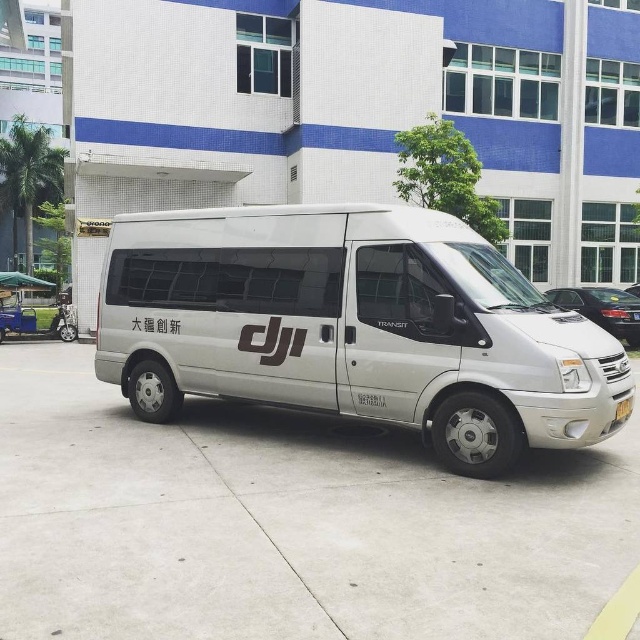
Question: Among these objects, which one is farthest from the camera?

Choices:
 (A) white concrete pavement at center
 (B) white metallic van at center

Answer: (B)

Question: Does white concrete pavement at center lie in front of white metallic van at center?

Choices:
 (A) no
 (B) yes

Answer: (B)

Question: Is white metallic van at center below yellow rubber curb at lower right?

Choices:
 (A) no
 (B) yes

Answer: (A)

Question: Among these points, which one is nearest to the camera?

Choices:
 (A) (136, 285)
 (B) (628, 625)

Answer: (B)

Question: Where is white concrete pavement at center located in relation to yellow rubber curb at lower right in the image?

Choices:
 (A) right
 (B) left

Answer: (B)

Question: Which object is closer to the camera taking this photo?

Choices:
 (A) yellow rubber curb at lower right
 (B) white metallic van at center

Answer: (A)